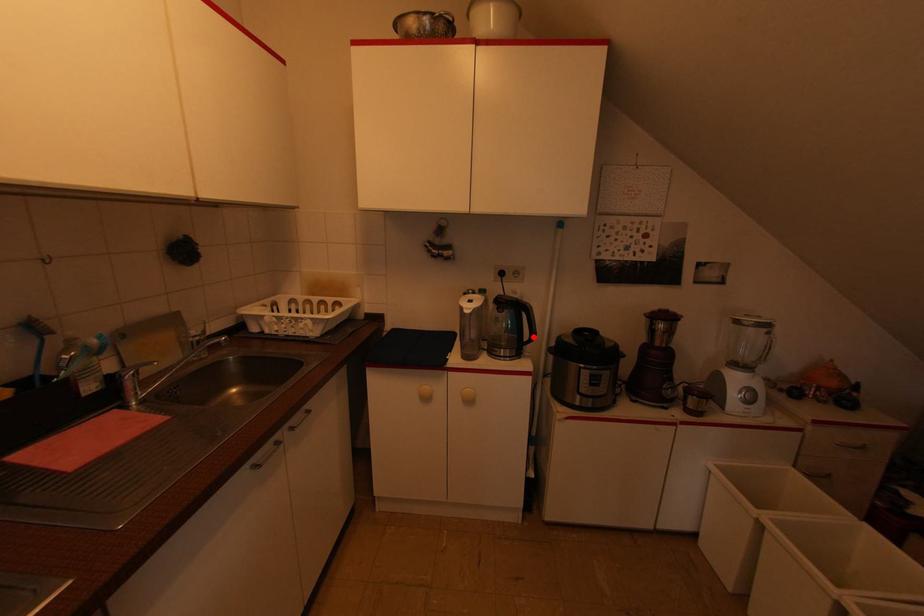
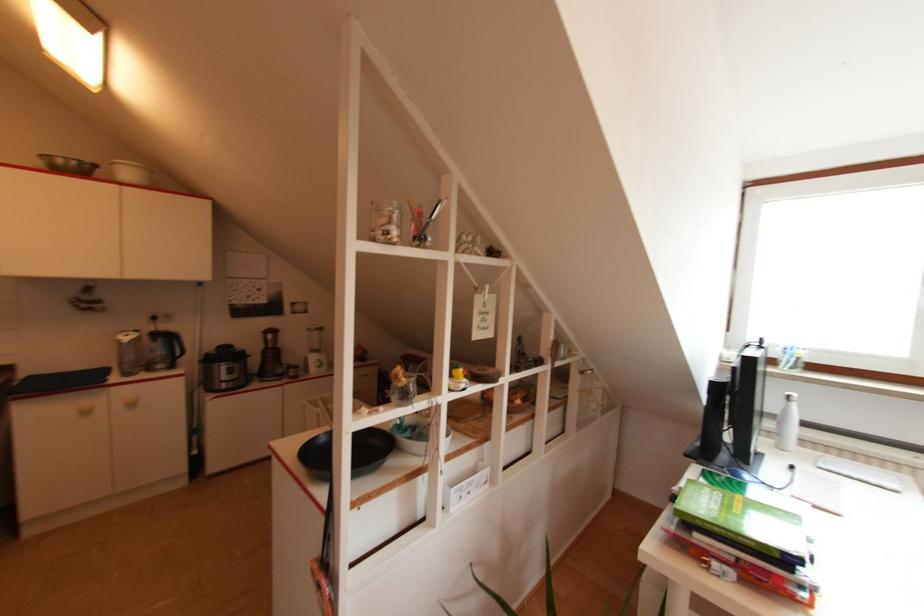
Find the pixel in the second image that matches the highlighted location in the first image.

(184, 352)